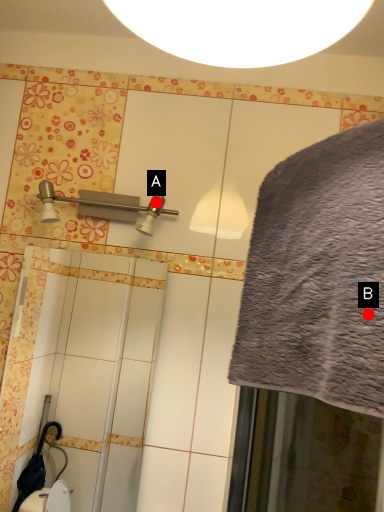
Question: Two points are circled on the image, labeled by A and B beside each circle. Among these points, which one is farthest from the camera?

Choices:
 (A) A is further
 (B) B is further

Answer: (A)